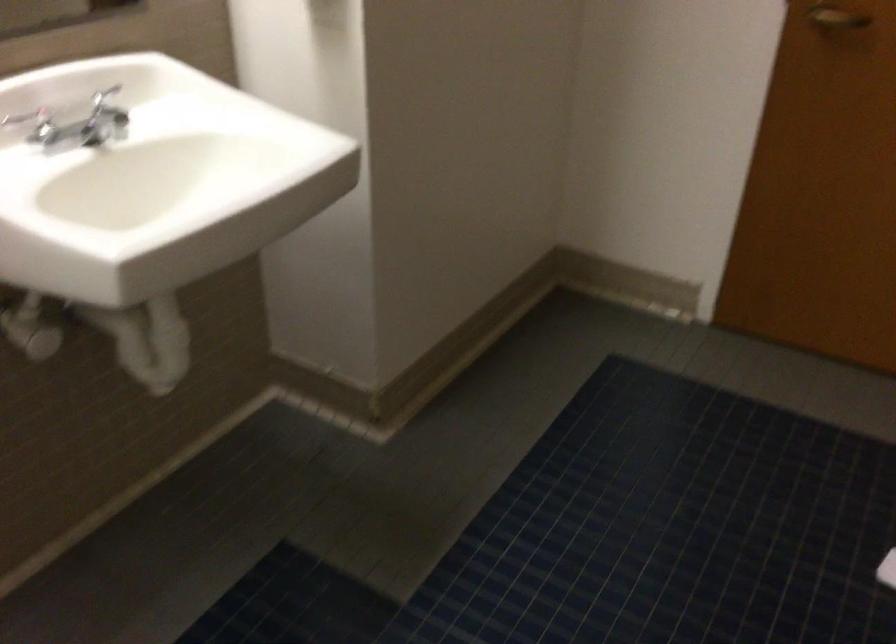
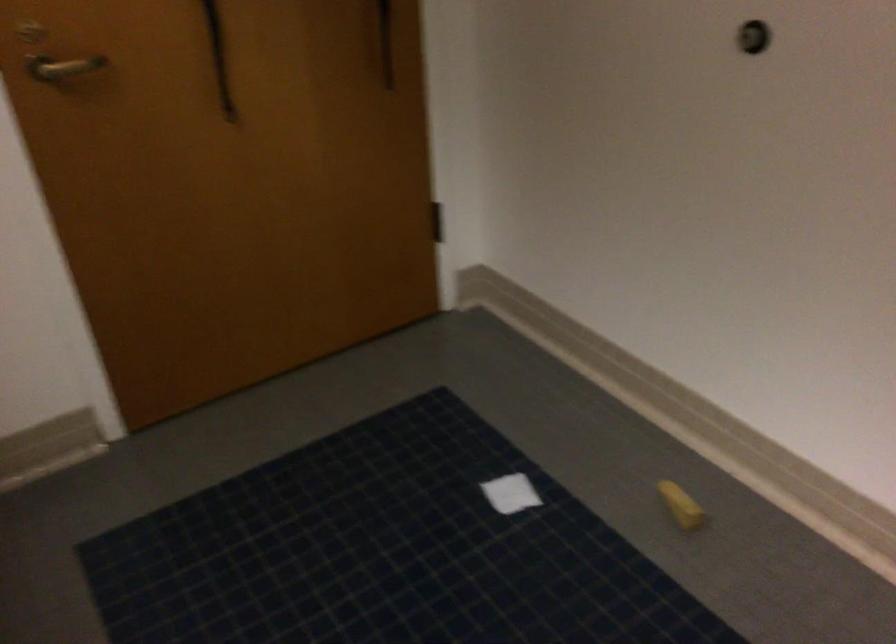
Question: The camera is either moving clockwise (left) or counter-clockwise (right) around the object. The first image is from the beginning of the video and the second image is from the end. Is the camera moving left or right when shooting the video?

Choices:
 (A) Left
 (B) Right

Answer: (A)